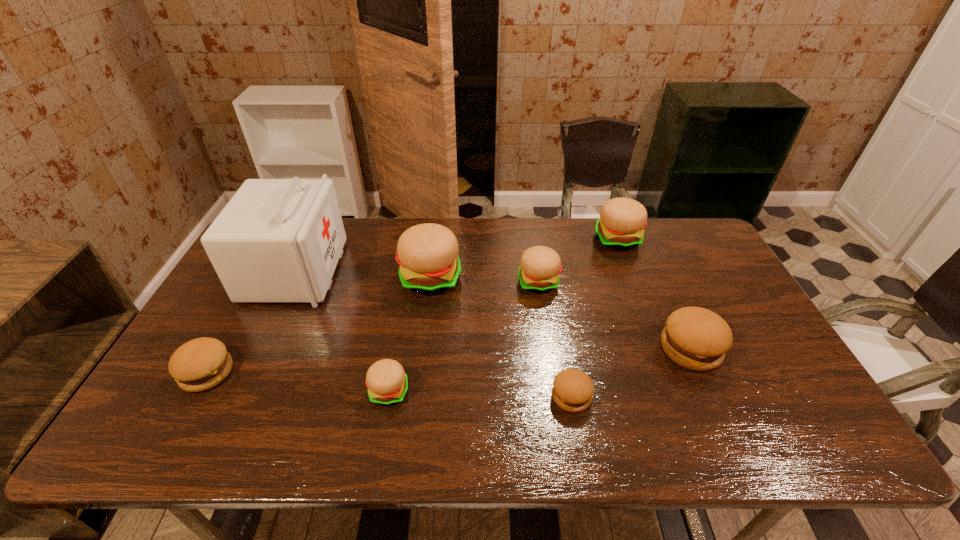
Where is `vacant region between the third biggest beige hamburger and the second tallest object`? The height and width of the screenshot is (540, 960). vacant region between the third biggest beige hamburger and the second tallest object is located at coordinates (485, 280).

Where is `vacant space that's between the rightmost brown hamburger and the second beige hamburger from right to left`? vacant space that's between the rightmost brown hamburger and the second beige hamburger from right to left is located at coordinates (614, 315).

This screenshot has height=540, width=960. I want to click on object that can be found as the seventh closest to the rightmost brown hamburger, so click(x=202, y=363).

Locate which object is the fifth closest to the leftmost hamburger. Please provide its 2D coordinates. Your answer should be formatted as a tuple, i.e. [(x, y)], where the tuple contains the x and y coordinates of a point satisfying the conditions above.

[(572, 391)]

Find the location of `the closest hamburger relative to the seventh shortest object`. the closest hamburger relative to the seventh shortest object is located at coordinates (540, 266).

Identify which hamburger is the sixth closest to the first-aid kit. Please provide its 2D coordinates. Your answer should be formatted as a tuple, i.e. [(x, y)], where the tuple contains the x and y coordinates of a point satisfying the conditions above.

[(621, 225)]

Identify which beige hamburger is the second closest to the farthest beige hamburger. Please provide its 2D coordinates. Your answer should be formatted as a tuple, i.e. [(x, y)], where the tuple contains the x and y coordinates of a point satisfying the conditions above.

[(427, 254)]

Locate which beige hamburger ranks third in proximity to the second beige hamburger from right to left. Please provide its 2D coordinates. Your answer should be formatted as a tuple, i.e. [(x, y)], where the tuple contains the x and y coordinates of a point satisfying the conditions above.

[(386, 380)]

Locate an element on the screen. The width and height of the screenshot is (960, 540). brown hamburger that is the second closest to the shortest hamburger is located at coordinates (202, 363).

Where is `brown hamburger that is the closest to the leftmost brown hamburger`? The height and width of the screenshot is (540, 960). brown hamburger that is the closest to the leftmost brown hamburger is located at coordinates (572, 391).